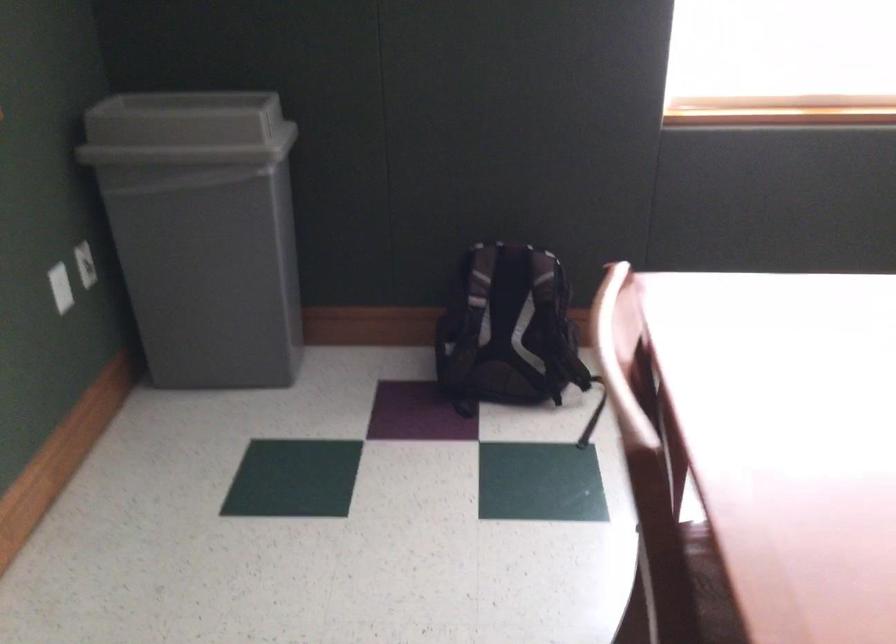
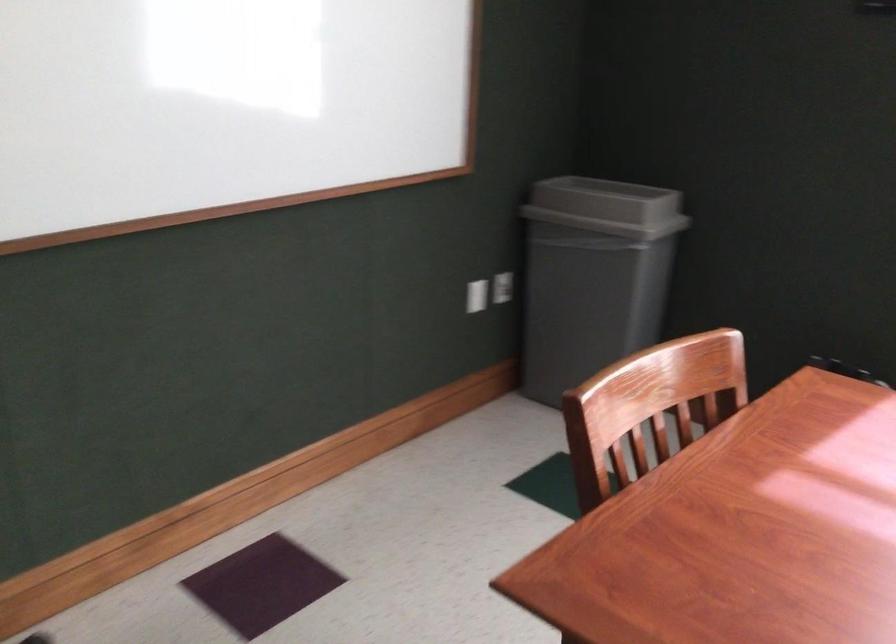
Locate, in the second image, the point that corresponds to point (213, 128) in the first image.

(607, 207)